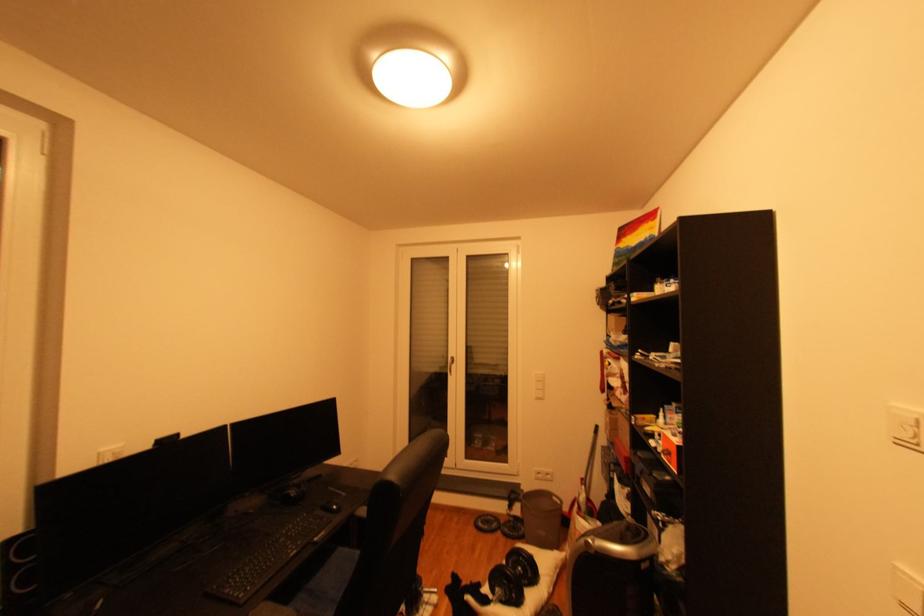
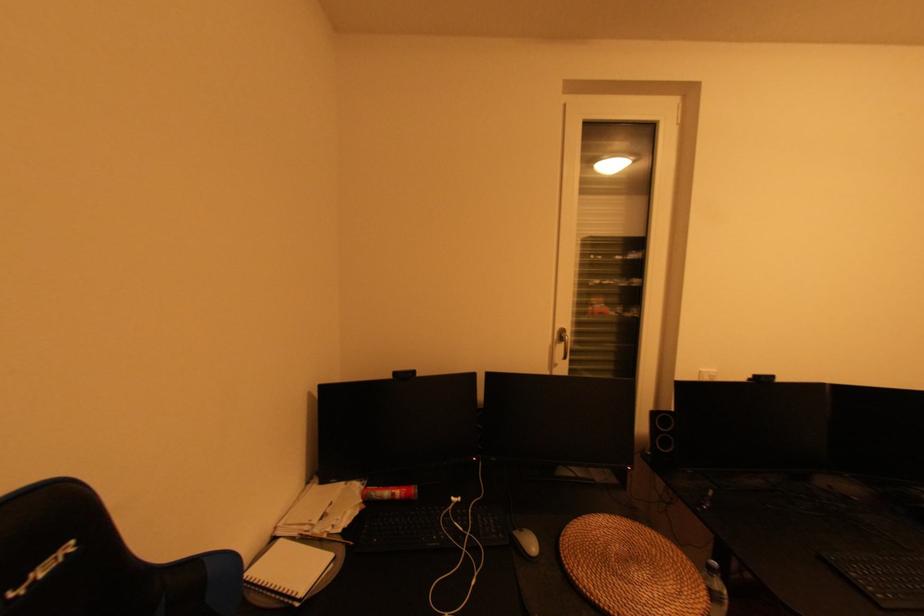
Question: The camera is either moving clockwise (left) or counter-clockwise (right) around the object. The first image is from the beginning of the video and the second image is from the end. Is the camera moving left or right when shooting the video?

Choices:
 (A) Left
 (B) Right

Answer: (B)